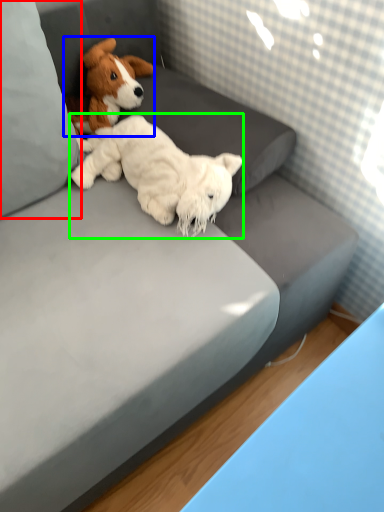
Question: Estimate the real-world distances between objects in this image. Which object is closer to pillow (highlighted by a red box), dog (highlighted by a blue box) or dog (highlighted by a green box)?

Choices:
 (A) dog
 (B) dog

Answer: (B)